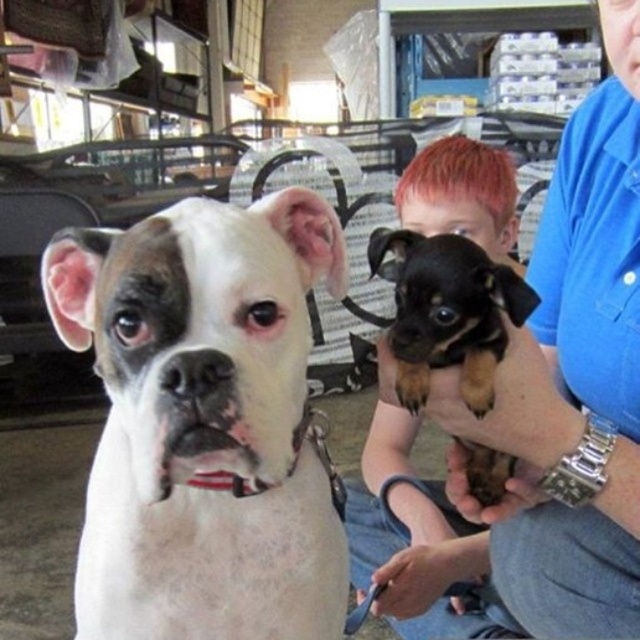
Does point (460, 557) come behind point (419, 419)?

Yes, it is.

Between smooth blue shirt at upper right and smooth black fur at center, which one appears on the right side from the viewer's perspective?

Positioned to the right is smooth blue shirt at upper right.

The width and height of the screenshot is (640, 640). I want to click on smooth blue shirt at upper right, so click(x=540, y=417).

The width and height of the screenshot is (640, 640). I want to click on smooth blue shirt at upper right, so click(x=540, y=417).

Identify the location of smooth black fur at center. (417, 541).

Which is below, smooth black fur at center or black and tan fur puppy at center?

smooth black fur at center is lower down.

The height and width of the screenshot is (640, 640). Identify the location of smooth black fur at center. (417, 541).

The image size is (640, 640). In order to click on smooth black fur at center in this screenshot , I will do `click(417, 541)`.

Who is positioned more to the left, white fur dog at left or smooth blue shirt at upper right?

Positioned to the left is white fur dog at left.

Who is more distant from viewer, (212, 352) or (580, 353)?

The point (580, 353) is more distant.

Locate an element on the screen. white fur dog at left is located at coordinates (204, 420).